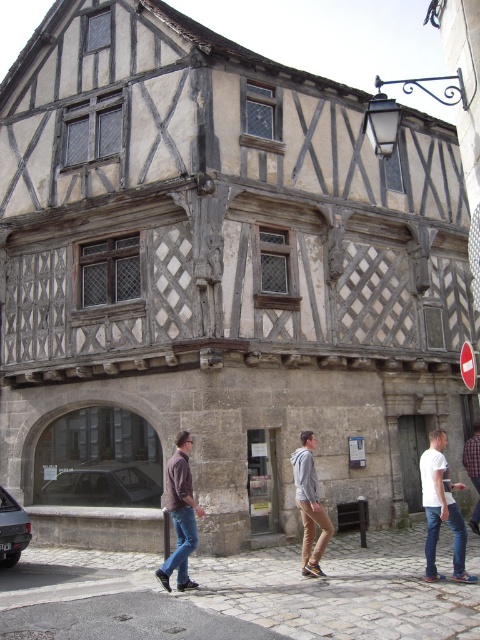
Based on the photo, you are a customer entering the historic building and see a brown leather jacket at center and a gray hoodie at center. Which clothing item is positioned to the left when facing the entrance?

The brown leather jacket at center is to the left of the gray hoodie at center when facing the entrance.

You are a customer entering the historic building and see both the brown leather jacket at center and the gray hoodie at center displayed in the shop window. Which item takes up more space in the window display?

The brown leather jacket at center is larger in size than the gray hoodie at center, so it takes up more space in the window display.